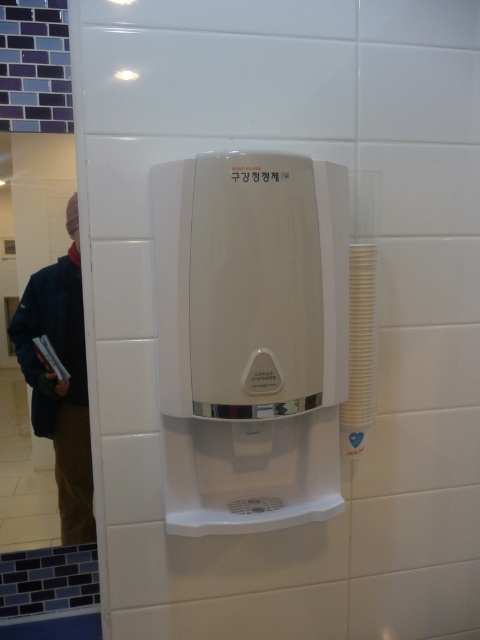
Can you confirm if white plastic water heater at center is positioned to the right of dark blue denim jacket at left?

Indeed, white plastic water heater at center is positioned on the right side of dark blue denim jacket at left.

Which is behind, point (194, 259) or point (50, 397)?

Positioned behind is point (50, 397).

Does point (173, 420) come farther from viewer compared to point (81, 518)?

No, it is not.

Where is `white plastic water heater at center`? This screenshot has width=480, height=640. white plastic water heater at center is located at coordinates (250, 339).